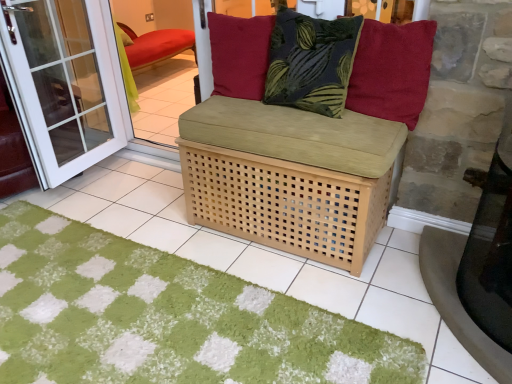
This screenshot has height=384, width=512. Identify the location of vacant space positioned to the left of natural wood basket at center. (165, 213).